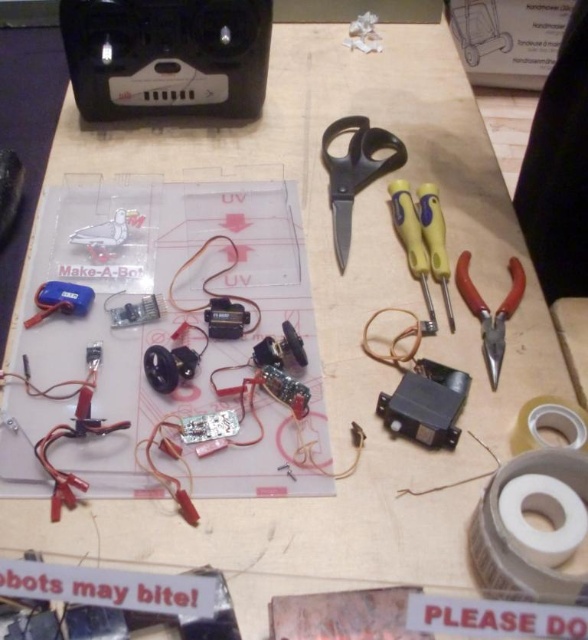
Is black plastic scissors at center wider than yellow plastic screwdriver at right?

Yes, black plastic scissors at center is wider than yellow plastic screwdriver at right.

Identify the location of black plastic scissors at center. (355, 172).

Does point (489, 337) come farther from viewer compared to point (433, 262)?

No, it is in front of (433, 262).

Is red plastic pliers at lower right positioned at the back of yellow plastic screwdriver at center-right?

That is False.

Image resolution: width=588 pixels, height=640 pixels. What are the coordinates of `red plastic pliers at lower right` in the screenshot? It's located at (489, 310).

Based on the photo, does black plastic scissors at center appear on the right side of yellow plastic screwdriver at center-right?

Incorrect, black plastic scissors at center is not on the right side of yellow plastic screwdriver at center-right.

Can you confirm if black plastic scissors at center is positioned to the left of yellow plastic screwdriver at center-right?

Yes, black plastic scissors at center is to the left of yellow plastic screwdriver at center-right.

Locate an element on the screen. The height and width of the screenshot is (640, 588). black plastic scissors at center is located at coordinates (355, 172).